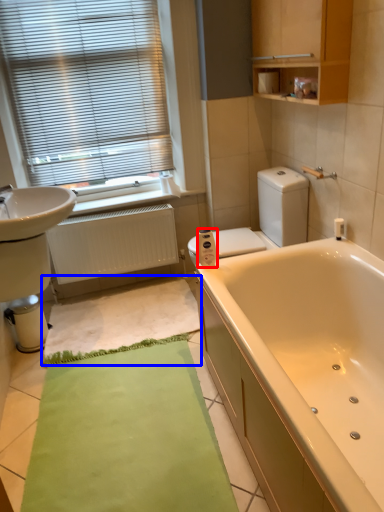
Question: Which point is further to the camera, toilet paper (highlighted by a red box) or bath mat (highlighted by a blue box)?

Choices:
 (A) toilet paper
 (B) bath mat

Answer: (B)